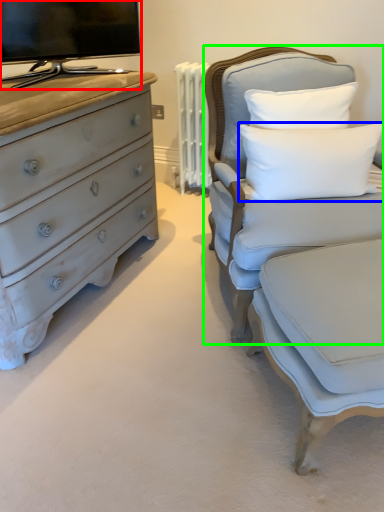
Question: Estimate the real-world distances between objects in this image. Which object is closer to television (highlighted by a red box), pillow (highlighted by a blue box) or chair (highlighted by a green box)?

Choices:
 (A) pillow
 (B) chair

Answer: (B)